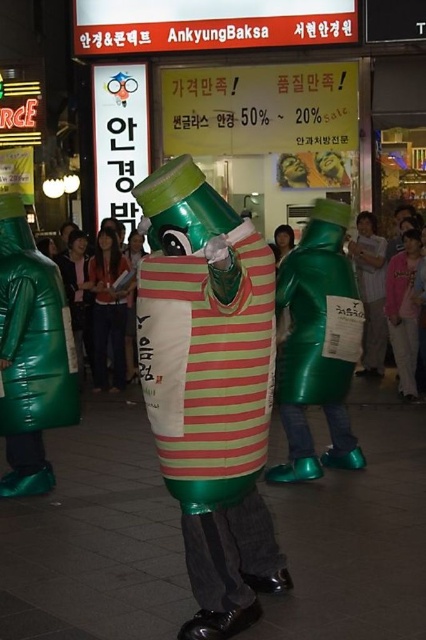
Question: Among these points, which one is farthest from the camera?

Choices:
 (A) (376, 323)
 (B) (42, 394)
 (C) (256, 518)
 (D) (399, 376)

Answer: (A)

Question: Does green shiny bottle at left have a lesser width compared to pink fabric shirt at center?

Choices:
 (A) no
 (B) yes

Answer: (A)

Question: Is striped fabric can at center wider than striped fabric bottle at center?

Choices:
 (A) yes
 (B) no

Answer: (A)

Question: Among these points, which one is farthest from the camera?

Choices:
 (A) (120, 269)
 (B) (370, 308)
 (C) (337, 416)

Answer: (B)

Question: Which of the following is the farthest from the observer?

Choices:
 (A) (178, 323)
 (B) (354, 368)
 (C) (92, 264)
 (D) (40, 454)

Answer: (C)

Question: Is green matte bottle at center to the right of striped fabric bottle at center from the viewer's perspective?

Choices:
 (A) no
 (B) yes

Answer: (B)